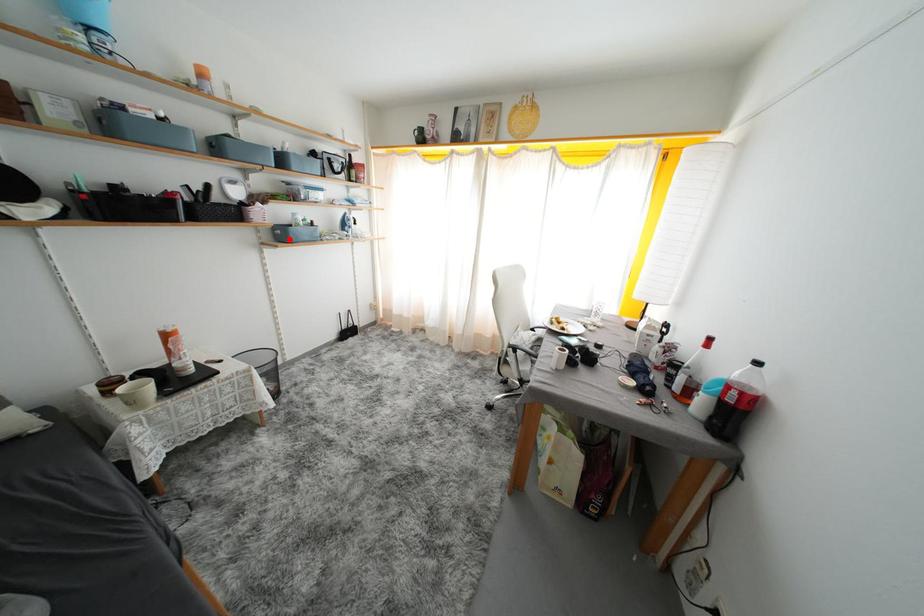
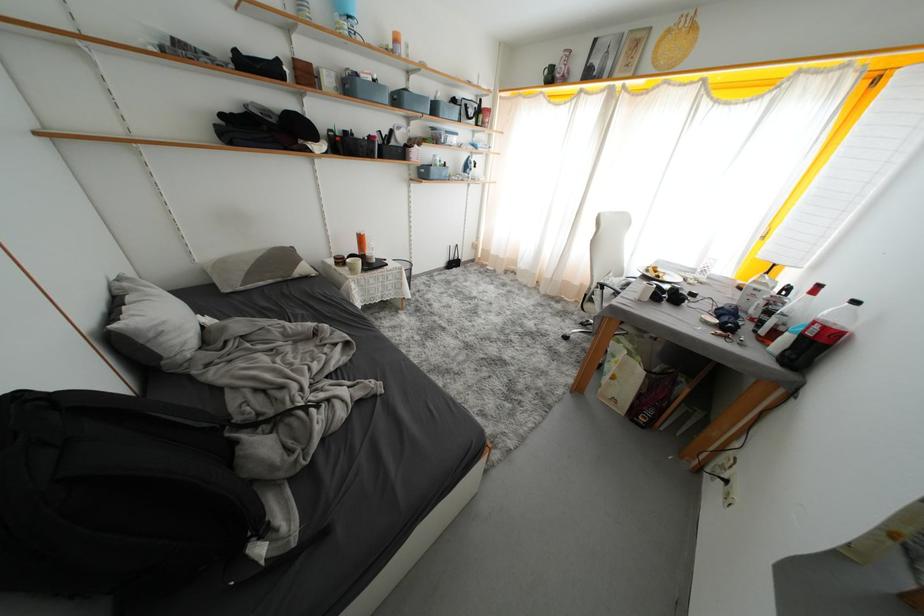
The point at the highlighted location is marked in the first image. Where is the corresponding point in the second image?

(431, 177)